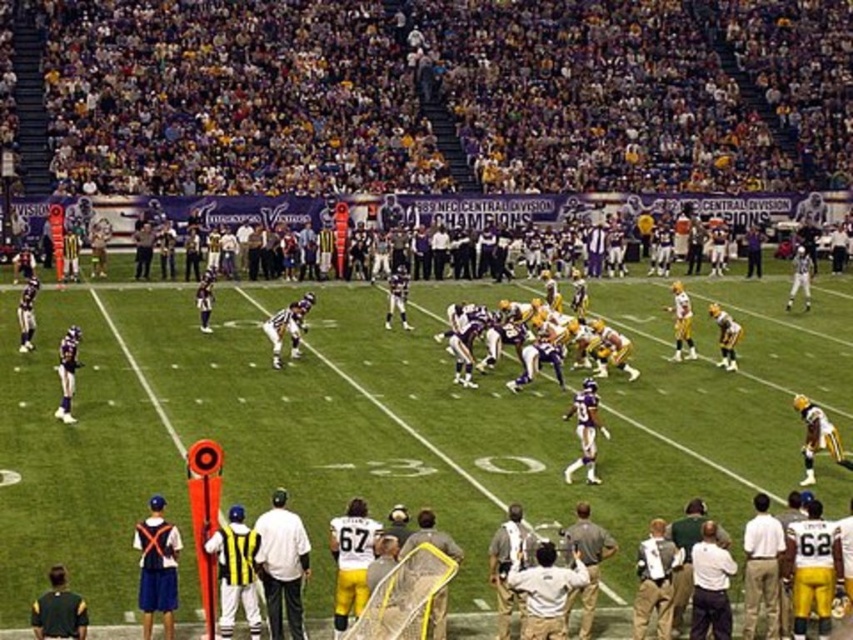
What do you see at coordinates (427, 93) in the screenshot? I see `dark purple jersey at upper center` at bounding box center [427, 93].

Who is higher up, dark purple jersey at upper center or white matte shirt at center?

dark purple jersey at upper center is higher up.

What do you see at coordinates (427, 93) in the screenshot? I see `dark purple jersey at upper center` at bounding box center [427, 93].

Identify the location of dark purple jersey at upper center. (427, 93).